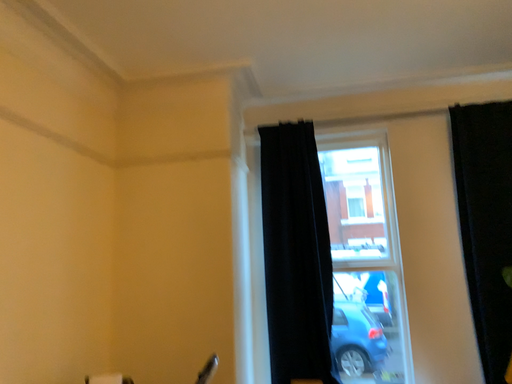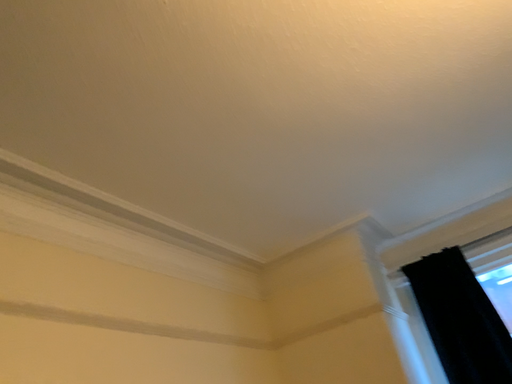
Question: How did the camera likely rotate when shooting the video?

Choices:
 (A) rotated upward
 (B) rotated downward

Answer: (A)